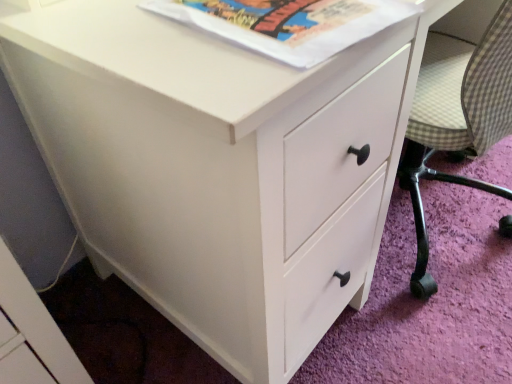
Question: Looking at their shapes, would you say white paper at upper center is wider or thinner than checkered fabric armchair at right?

Choices:
 (A) wide
 (B) thin

Answer: (B)

Question: Is point (248, 34) positioned closer to the camera than point (435, 135)?

Choices:
 (A) closer
 (B) farther

Answer: (A)

Question: Is white paper at upper center inside or outside of checkered fabric armchair at right?

Choices:
 (A) outside
 (B) inside

Answer: (A)

Question: Is checkered fabric armchair at right taller or shorter than white paper at upper center?

Choices:
 (A) short
 (B) tall

Answer: (B)

Question: Is checkered fabric armchair at right in front of or behind white paper at upper center in the image?

Choices:
 (A) front
 (B) behind

Answer: (B)

Question: Does point (413, 152) appear closer or farther from the camera than point (278, 21)?

Choices:
 (A) closer
 (B) farther

Answer: (B)

Question: Do you think checkered fabric armchair at right is within white paper at upper center, or outside of it?

Choices:
 (A) inside
 (B) outside

Answer: (B)